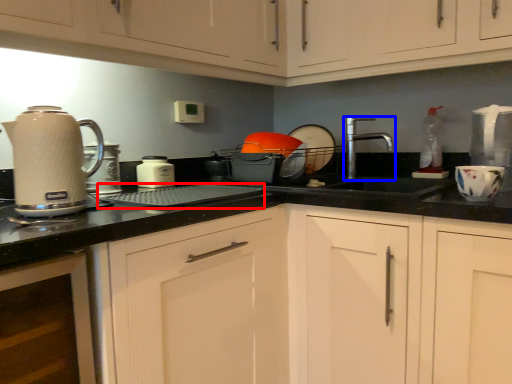
Question: Which point is further to the camera, appliance (highlighted by a red box) or tap (highlighted by a blue box)?

Choices:
 (A) appliance
 (B) tap

Answer: (B)